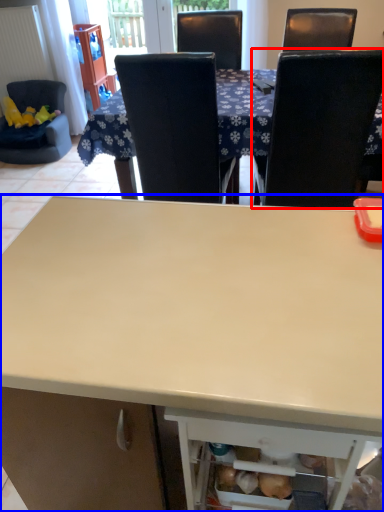
Question: Which of the following is the closest to the observer, chair (highlighted by a red box) or desk (highlighted by a blue box)?

Choices:
 (A) chair
 (B) desk

Answer: (B)